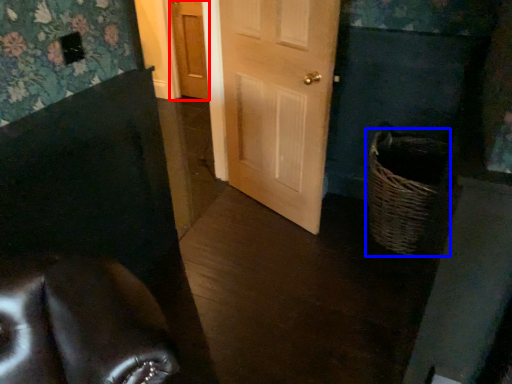
Question: Which object appears farthest to the camera in this image, door (highlighted by a red box) or basket (highlighted by a blue box)?

Choices:
 (A) door
 (B) basket

Answer: (A)